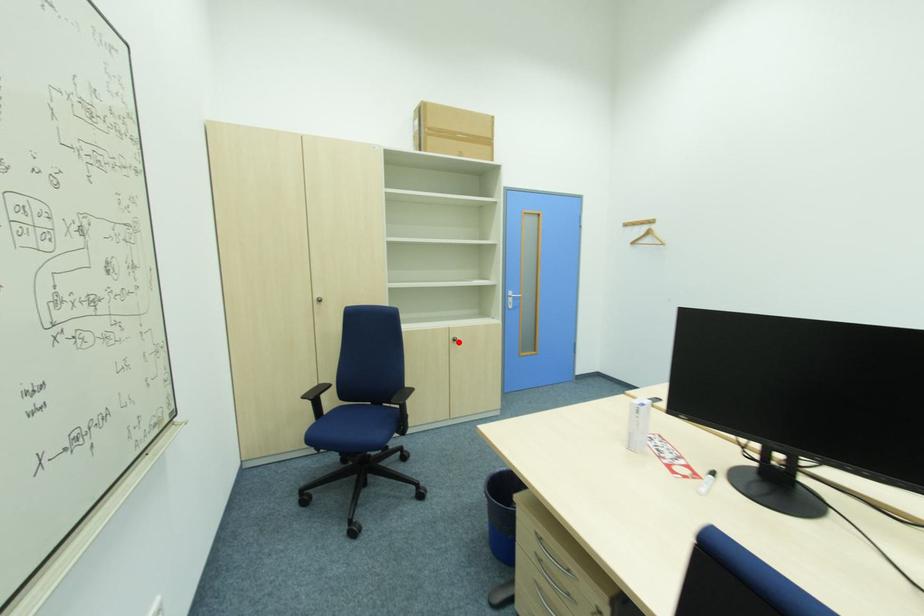
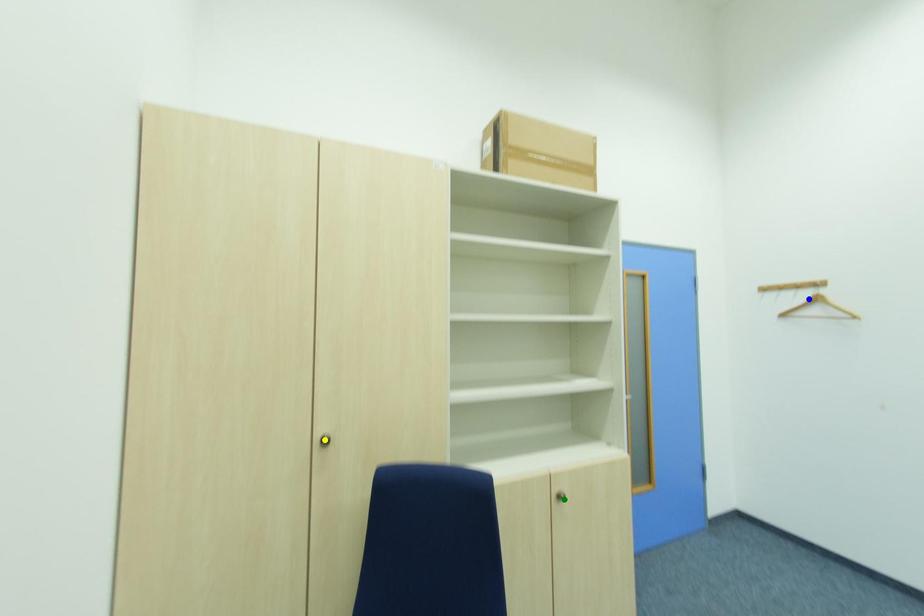
Question: I am providing you with two images of the same scene from different viewpoints. A red point is marked on the first image. You are given multiple points on the second image. Which spot in image 2 lines up with the point in image 1?

Choices:
 (A) blue point
 (B) green point
 (C) yellow point

Answer: (B)